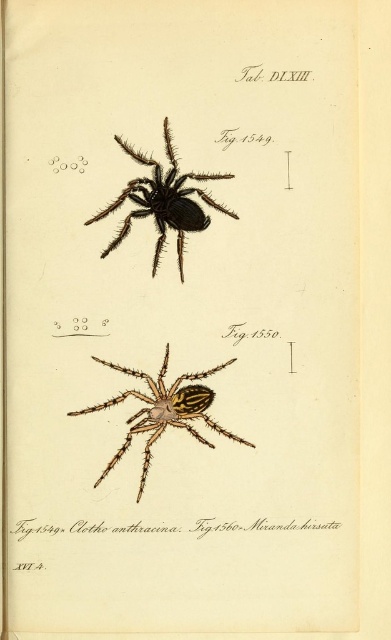
Question: Is black matte spider at upper center thinner than yellow-striped silk spider at center?

Choices:
 (A) no
 (B) yes

Answer: (B)

Question: Is black matte spider at upper center positioned at the back of yellow-striped silk spider at center?

Choices:
 (A) no
 (B) yes

Answer: (B)

Question: Which point appears closest to the camera in this image?

Choices:
 (A) (109, 205)
 (B) (77, 412)

Answer: (B)

Question: Which object is closer to the camera taking this photo?

Choices:
 (A) black matte spider at upper center
 (B) yellow-striped silk spider at center

Answer: (B)

Question: Does black matte spider at upper center appear over yellow-striped silk spider at center?

Choices:
 (A) no
 (B) yes

Answer: (B)